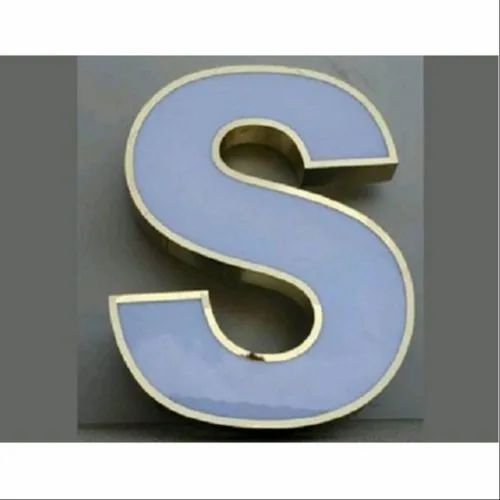
Identify the location of grey wall. The width and height of the screenshot is (500, 500). (100, 106).